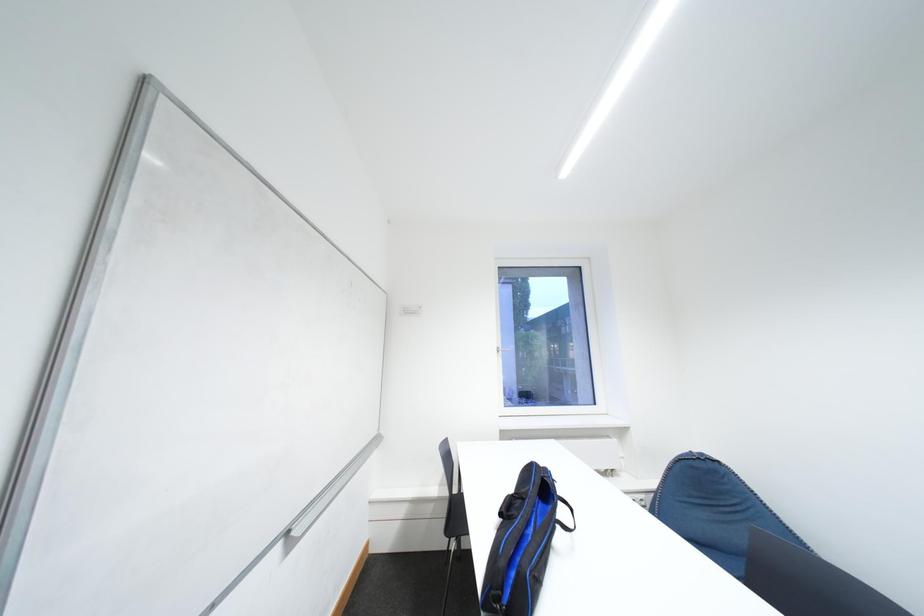
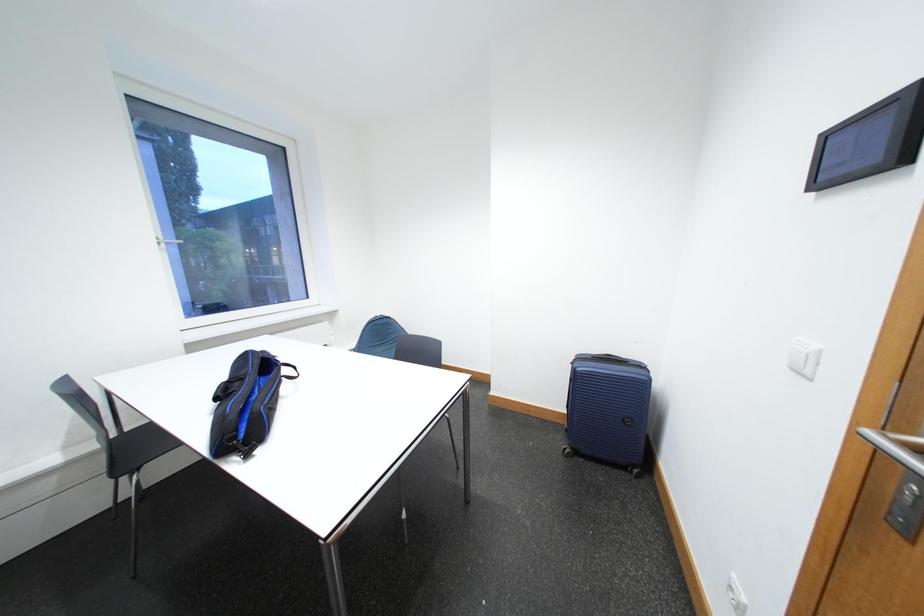
The images are taken continuously from a first-person perspective. In which direction is your viewpoint rotating?

The camera rotated toward right-down.